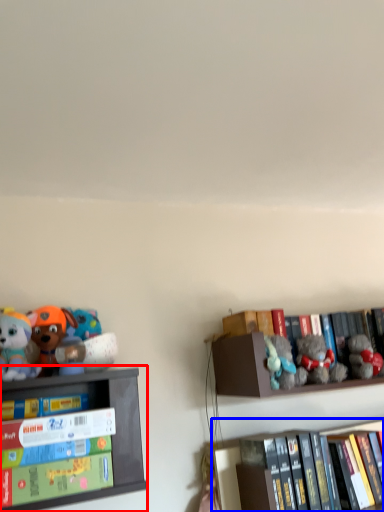
Question: Which of the following is the closest to the observer, shelf (highlighted by a red box) or shelf (highlighted by a blue box)?

Choices:
 (A) shelf
 (B) shelf

Answer: (A)